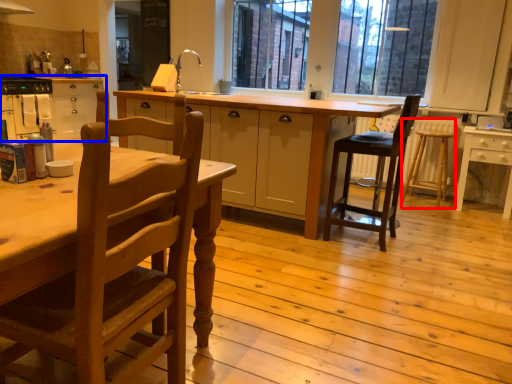
Question: Which of the following is the closest to the observer, bar stool (highlighted by a red box) or cabinetry (highlighted by a blue box)?

Choices:
 (A) bar stool
 (B) cabinetry

Answer: (A)